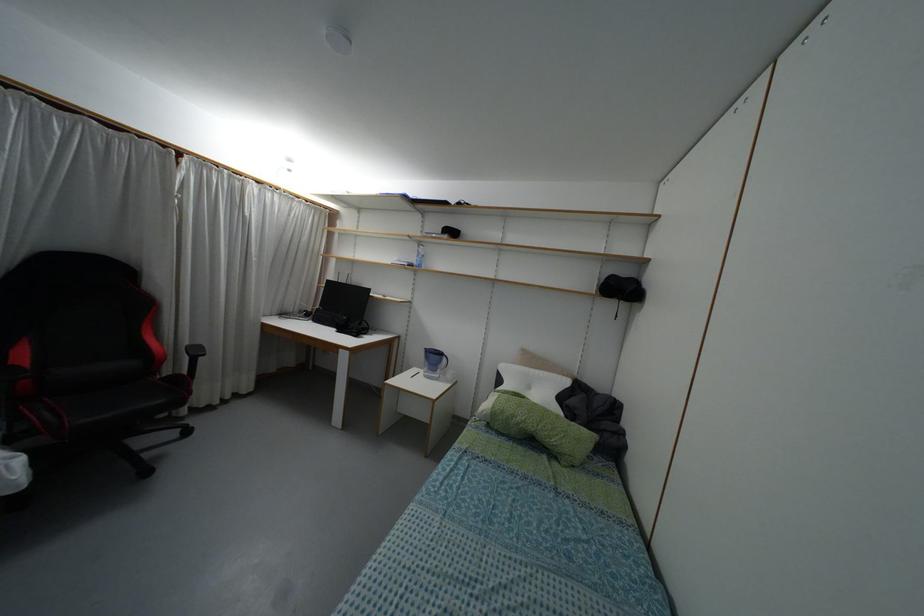
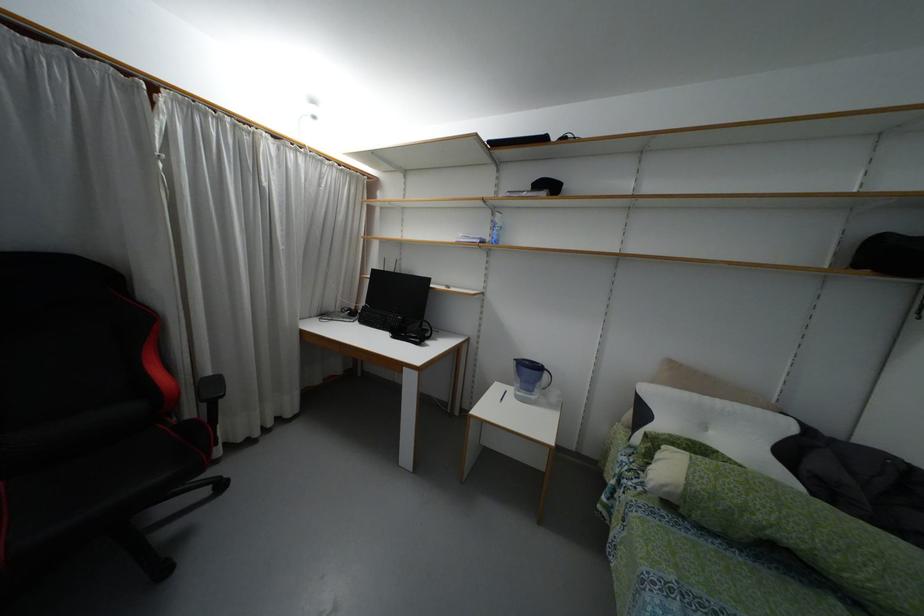
The images are taken continuously from a first-person perspective. In which direction are you moving?

The movement direction of the cameraman is left, forward.